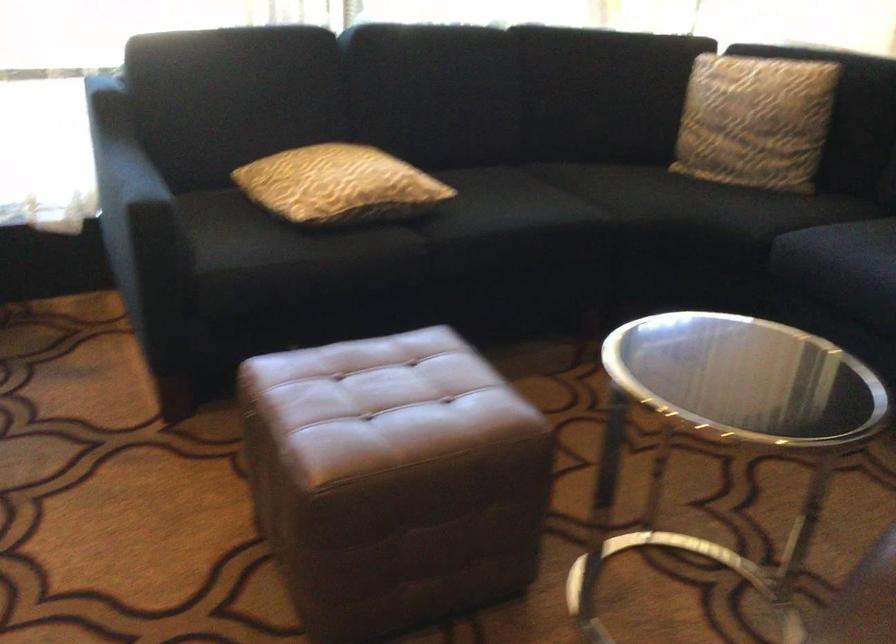
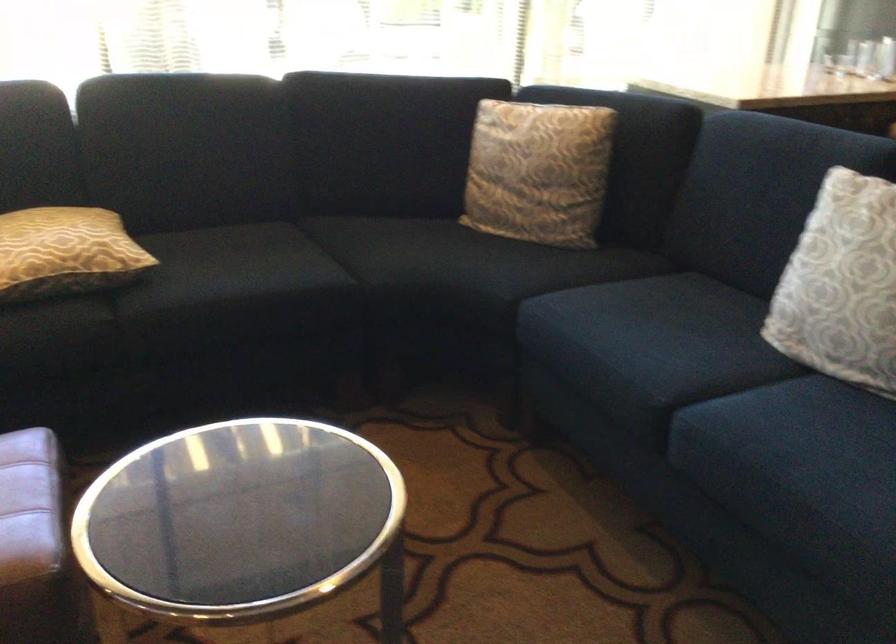
In the second image, find the point that corresponds to (x=378, y=184) in the first image.

(65, 252)